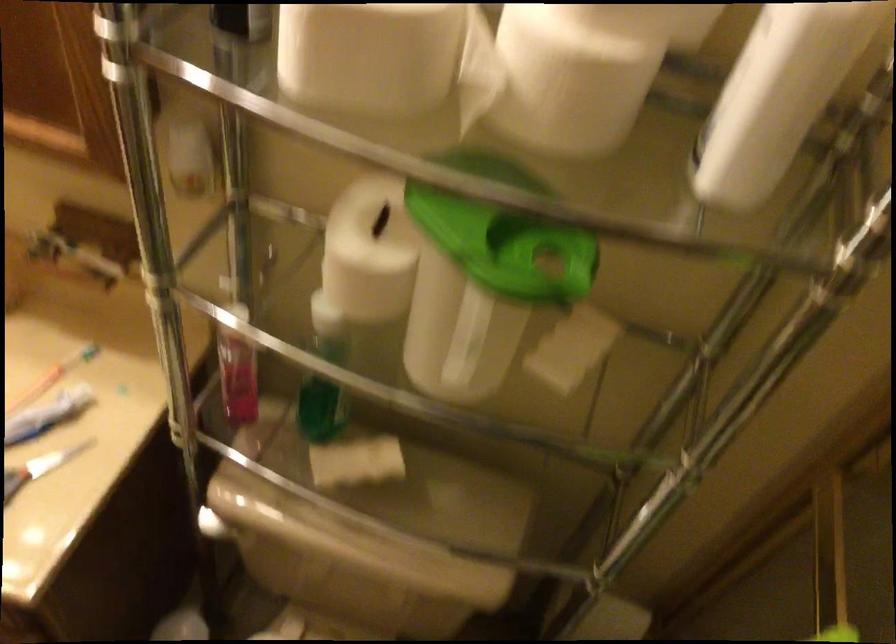
The image size is (896, 644). I want to click on white bottle, so click(778, 96).